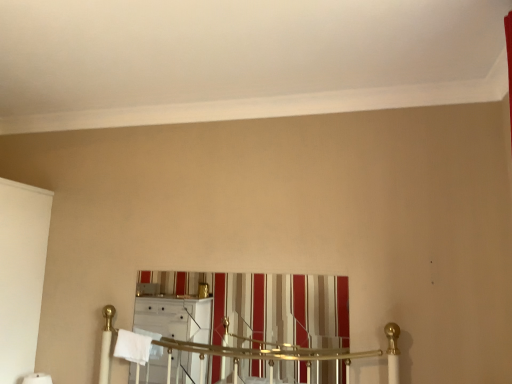
What do you see at coordinates (283, 308) in the screenshot? I see `striped fabric curtain at center` at bounding box center [283, 308].

In order to face striped fabric curtain at center, should I rotate leftwards or rightwards?

Turn left by 2.725 degrees to look at striped fabric curtain at center.

Where is `striped fabric curtain at center`? The width and height of the screenshot is (512, 384). striped fabric curtain at center is located at coordinates (283, 308).

This screenshot has width=512, height=384. What do you see at coordinates (133, 347) in the screenshot?
I see `white soft bath towel at center` at bounding box center [133, 347].

In order to face white soft bath towel at center, should I rotate leftwards or rightwards?

A 15.800 degree turn to the left will do.

You are a GUI agent. You are given a task and a screenshot of the screen. Output one action in this format:
    pyautogui.click(x=<x>, y=<y>)
    Task: Click on the white soft bath towel at center
    
    Given the screenshot: What is the action you would take?
    pyautogui.click(x=133, y=347)

Find the location of a particular element. striped fabric curtain at center is located at coordinates (283, 308).

Which object is positioned more to the right, striped fabric curtain at center or white soft bath towel at center?

striped fabric curtain at center is more to the right.

Which is behind, striped fabric curtain at center or white soft bath towel at center?

white soft bath towel at center is behind.

Is point (253, 329) farther from camera compared to point (133, 342)?

That is False.

From the image's perspective, is striped fabric curtain at center on top of white soft bath towel at center?

Yes.

From a real-world perspective, is striped fabric curtain at center positioned above or below white soft bath towel at center?

striped fabric curtain at center is situated higher than white soft bath towel at center in the real world.

Considering the relative sizes of striped fabric curtain at center and white soft bath towel at center in the image provided, is striped fabric curtain at center wider than white soft bath towel at center?

Incorrect, the width of striped fabric curtain at center does not surpass that of white soft bath towel at center.

Which of these two, striped fabric curtain at center or white soft bath towel at center, stands taller?

With more height is striped fabric curtain at center.

In terms of size, does striped fabric curtain at center appear bigger or smaller than white soft bath towel at center?

Clearly, striped fabric curtain at center is larger in size than white soft bath towel at center.

Would you say striped fabric curtain at center is outside white soft bath towel at center?

striped fabric curtain at center lies outside white soft bath towel at center's area.

Is striped fabric curtain at center touching white soft bath towel at center?

No, striped fabric curtain at center is not with white soft bath towel at center.

Is striped fabric curtain at center aimed at white soft bath towel at center?

Yes, striped fabric curtain at center is oriented towards white soft bath towel at center.

How different are the orientations of striped fabric curtain at center and white soft bath towel at center in degrees?

There is a 1.59-degree angle between the facing directions of striped fabric curtain at center and white soft bath towel at center.

Where is `bath towel located on the left of striped fabric curtain at center`? bath towel located on the left of striped fabric curtain at center is located at coordinates (133, 347).

Between white soft bath towel at center and striped fabric curtain at center, which one appears on the left side from the viewer's perspective?

white soft bath towel at center is more to the left.

Is white soft bath towel at center behind striped fabric curtain at center?

Yes, white soft bath towel at center is behind striped fabric curtain at center.

Is point (140, 354) farther from viewer compared to point (319, 307)?

Yes, point (140, 354) is behind point (319, 307).

From the image's perspective, which one is positioned higher, white soft bath towel at center or striped fabric curtain at center?

From the image's view, striped fabric curtain at center is above.

From a real-world perspective, which is physically below, white soft bath towel at center or striped fabric curtain at center?

white soft bath towel at center.

Which of these two, white soft bath towel at center or striped fabric curtain at center, is thinner?

With smaller width is striped fabric curtain at center.

Between white soft bath towel at center and striped fabric curtain at center, which one has less height?

white soft bath towel at center.

Is white soft bath towel at center smaller than striped fabric curtain at center?

Correct, white soft bath towel at center occupies less space than striped fabric curtain at center.

Is white soft bath towel at center inside or outside of striped fabric curtain at center?

The correct answer is: outside.

Is white soft bath towel at center positioned far away from striped fabric curtain at center?

No, white soft bath towel at center is not far away from striped fabric curtain at center.

Is white soft bath towel at center positioned with its back to striped fabric curtain at center?

That's right, white soft bath towel at center is facing away from striped fabric curtain at center.

How distant is white soft bath towel at center from striped fabric curtain at center?

white soft bath towel at center and striped fabric curtain at center are 71.00 centimeters apart.

Where is `bath towel that appears below the striped fabric curtain at center (from the image's perspective)`? bath towel that appears below the striped fabric curtain at center (from the image's perspective) is located at coordinates (133, 347).

This screenshot has width=512, height=384. Identify the location of bath towel below the striped fabric curtain at center (from a real-world perspective). (133, 347).

Image resolution: width=512 pixels, height=384 pixels. I want to click on bath towel that appears on the left of striped fabric curtain at center, so click(x=133, y=347).